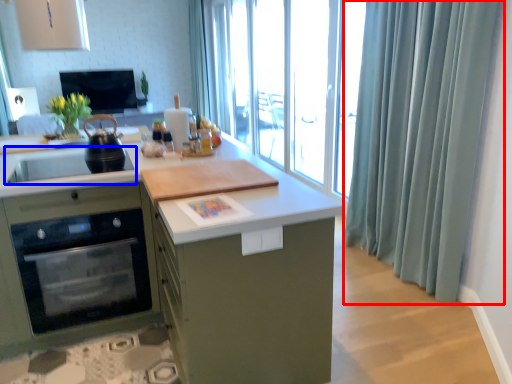
Question: Which of the following is the farthest to the observer, shower curtain (highlighted by a red box) or sink (highlighted by a blue box)?

Choices:
 (A) shower curtain
 (B) sink

Answer: (B)